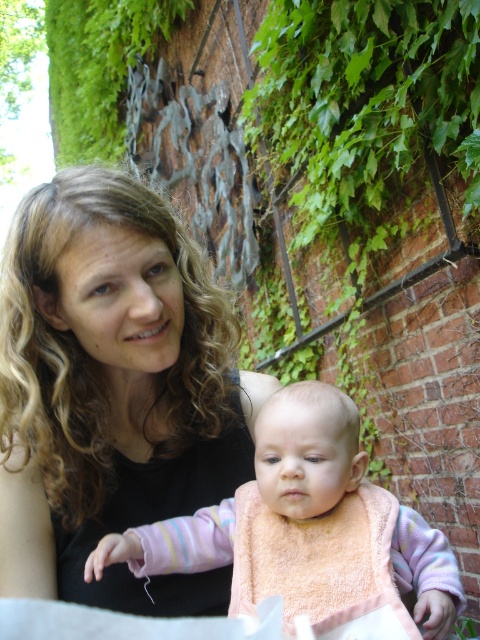
What are the coordinates of the black matte hair at upper left?

The black matte hair at upper left is located at point (112, 390).

Based on the photo, you are standing in front of the brick wall with ivy and want to place a small decoration at one of two specific points. The first point is at coordinates point (139, 502) and the second is at point (320, 385). Which point is closer to you?

Point (139, 502) is closer to you because it is further to the viewer than point (320, 385).